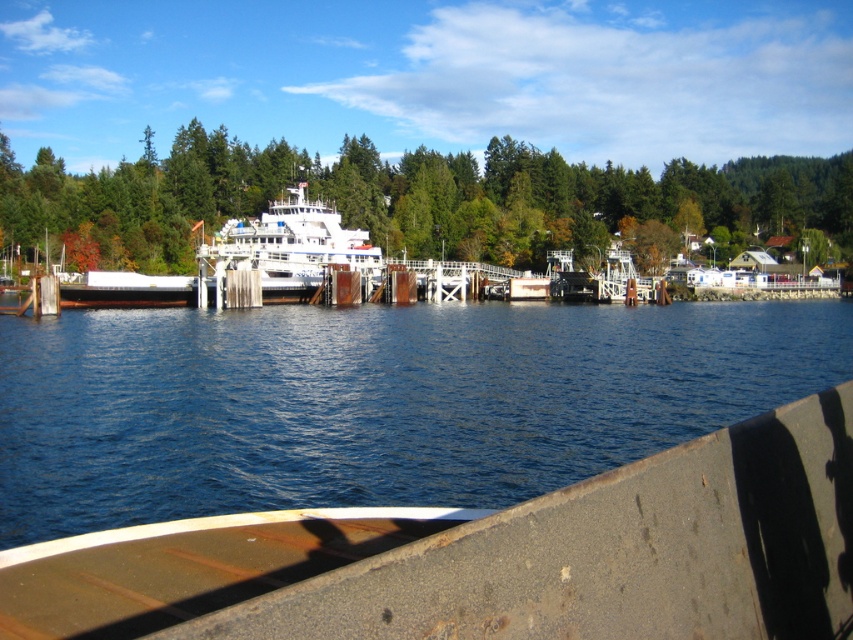
What is located at the coordinates point [374,401] in the image?

The coordinates point [374,401] in the image correspond to the blue water at center.

You are standing on the boat deck in the foreground of the image. You see the blue water at center and the white glossy ferry at center. Which object is closer to you?

The blue water at center is closer to you because it is positioned in front of the white glossy ferry at center.

You are on a boat and see the green matte tree at center and the white glossy ferry at center. Which object is closer to you?

The green matte tree at center is closer to you because the white glossy ferry at center is behind it.